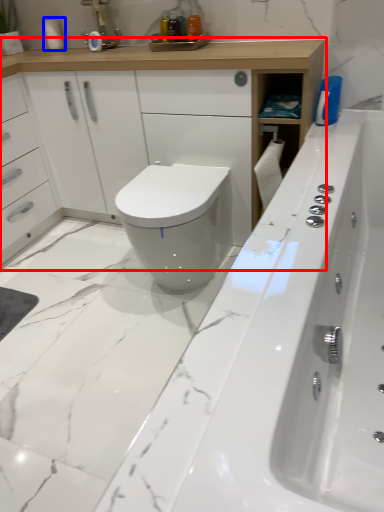
Question: Which of the following is the farthest to the observer, bathroom cabinet (highlighted by a red box) or toilet paper (highlighted by a blue box)?

Choices:
 (A) bathroom cabinet
 (B) toilet paper

Answer: (B)